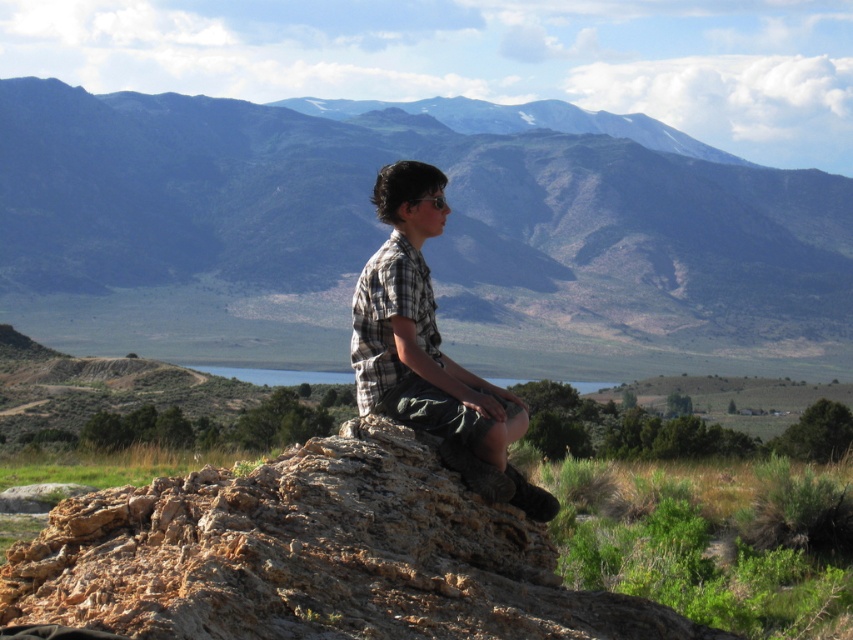
Question: Does brown rough rock at center have a smaller size compared to plaid shirt at center?

Choices:
 (A) no
 (B) yes

Answer: (A)

Question: Based on their relative distances, which object is farther from the blue glass lake at center?

Choices:
 (A) green grassy mountain at center
 (B) plaid shirt at center

Answer: (B)

Question: Can you confirm if green grassy mountain at center is positioned to the left of plaid shirt at center?

Choices:
 (A) no
 (B) yes

Answer: (B)

Question: Which object is positioned closest to the blue glass lake at center?

Choices:
 (A) brown rough rock at center
 (B) plaid shirt at center
 (C) green grassy mountain at center

Answer: (C)

Question: Is plaid shirt at center behind blue glass lake at center?

Choices:
 (A) no
 (B) yes

Answer: (A)

Question: Estimate the real-world distances between objects in this image. Which object is farther from the brown rough rock at center?

Choices:
 (A) green grassy mountain at center
 (B) blue glass lake at center

Answer: (A)